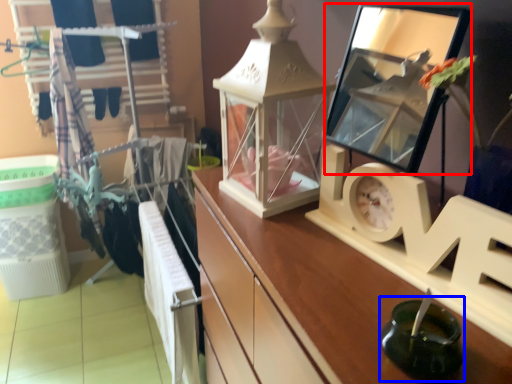
Question: Which of the following is the closest to the observer, mirror (highlighted by a red box) or candle holder (highlighted by a blue box)?

Choices:
 (A) mirror
 (B) candle holder

Answer: (B)